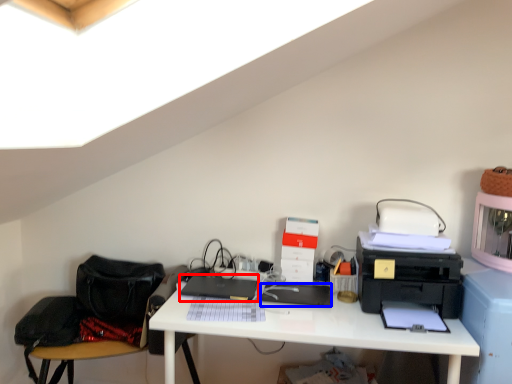
Question: Which of the following is the farthest to the observer, laptop (highlighted by a red box) or register (highlighted by a blue box)?

Choices:
 (A) laptop
 (B) register

Answer: (A)